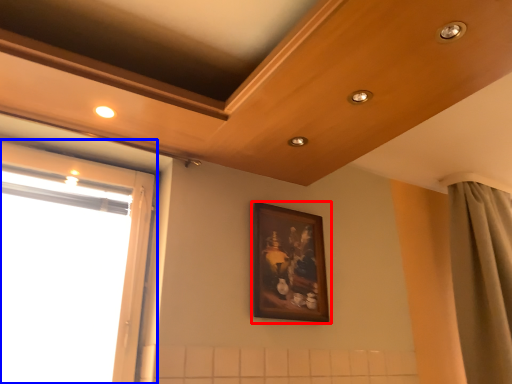
Question: Among these objects, which one is nearest to the camera, picture frame (highlighted by a red box) or window (highlighted by a blue box)?

Choices:
 (A) picture frame
 (B) window

Answer: (B)